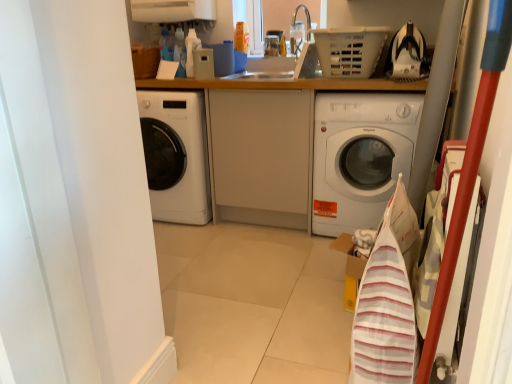
Question: Should I look upward or downward to see white plastic basket at upper center?

Choices:
 (A) down
 (B) up

Answer: (B)

Question: Is white glossy washing machine at center beside white plastic basket at upper center?

Choices:
 (A) yes
 (B) no

Answer: (B)

Question: From a real-world perspective, is white glossy washing machine at center located beneath white plastic basket at upper center?

Choices:
 (A) yes
 (B) no

Answer: (A)

Question: Are white glossy washing machine at center and white plastic basket at upper center far apart?

Choices:
 (A) no
 (B) yes

Answer: (A)

Question: Can you confirm if white glossy washing machine at center is positioned to the right of white plastic basket at upper center?

Choices:
 (A) yes
 (B) no

Answer: (A)

Question: From the image's perspective, would you say white glossy washing machine at center is positioned over white plastic basket at upper center?

Choices:
 (A) no
 (B) yes

Answer: (A)

Question: Could you tell me if white glossy washing machine at center is turned towards white plastic basket at upper center?

Choices:
 (A) no
 (B) yes

Answer: (A)

Question: Is white plastic basket at upper center to the right of white glossy washing machine at center from the viewer's perspective?

Choices:
 (A) no
 (B) yes

Answer: (A)

Question: From the image's perspective, does white plastic basket at upper center appear lower than white glossy washing machine at center?

Choices:
 (A) no
 (B) yes

Answer: (A)

Question: From a real-world perspective, is white plastic basket at upper center located beneath white glossy washing machine at center?

Choices:
 (A) no
 (B) yes

Answer: (A)

Question: Is white plastic basket at upper center oriented towards white glossy washing machine at center?

Choices:
 (A) no
 (B) yes

Answer: (A)

Question: Considering the relative sizes of white plastic basket at upper center and white glossy washing machine at center in the image provided, is white plastic basket at upper center taller than white glossy washing machine at center?

Choices:
 (A) no
 (B) yes

Answer: (A)

Question: Is white plastic basket at upper center smaller than white glossy washing machine at center?

Choices:
 (A) yes
 (B) no

Answer: (A)

Question: From their relative heights in the image, would you say white glossy washing machine at center is taller or shorter than white plastic basket at upper center?

Choices:
 (A) tall
 (B) short

Answer: (A)